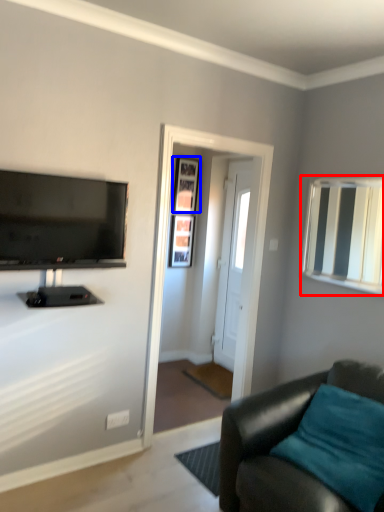
Question: Which point is closer to the camera, mirror (highlighted by a red box) or picture frame (highlighted by a blue box)?

Choices:
 (A) mirror
 (B) picture frame

Answer: (A)